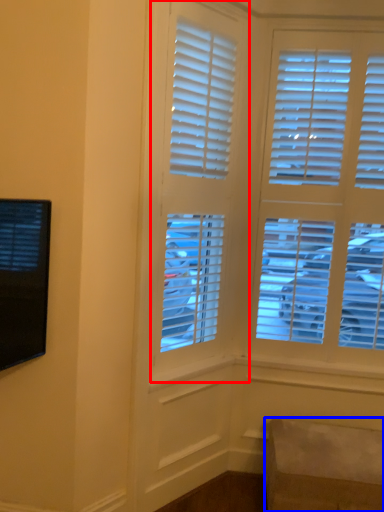
Question: Among these objects, which one is nearest to the camera, window (highlighted by a red box) or furniture (highlighted by a blue box)?

Choices:
 (A) window
 (B) furniture

Answer: (A)